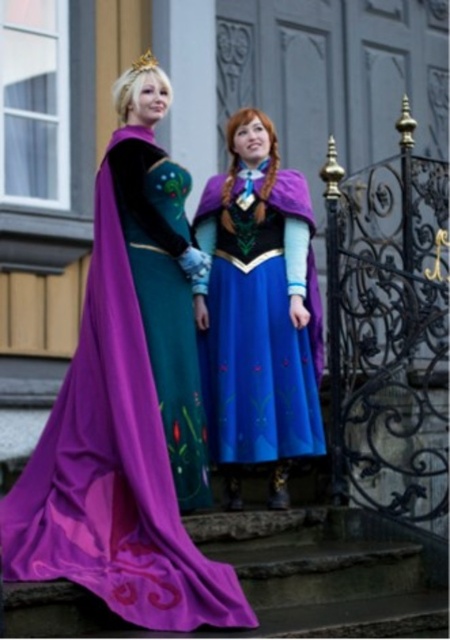
You are a photographer planning to take a portrait of the two individuals in the scene. You want to ensure that both the blue satin dress at center and the gold metallic crown at upper center are clearly visible in the frame. Based on their positions, which object should you focus on first to ensure both are in focus?

The blue satin dress at center is located below the gold metallic crown at upper center. To ensure both are in focus, you should focus on the gold metallic crown at upper center first since it is higher up, allowing the depth of field to naturally include the lower positioned blue satin dress at center.

You are a photographer setting up for a group photo. You need to ensure that both the purple satin cape at center and the blue satin dress at center are fully visible in the frame. Given their height difference, which one might require you to adjust your camera angle to avoid being cut off?

The purple satin cape at center is much taller than the blue satin dress at center, so you should adjust the camera angle to account for its greater height to prevent it from being cut off.

You are standing in front of the building with ornate architecture and see the blue satin dress at center. Where exactly is it located in the image?

The blue satin dress at center is located at point coordinates of [259,310].